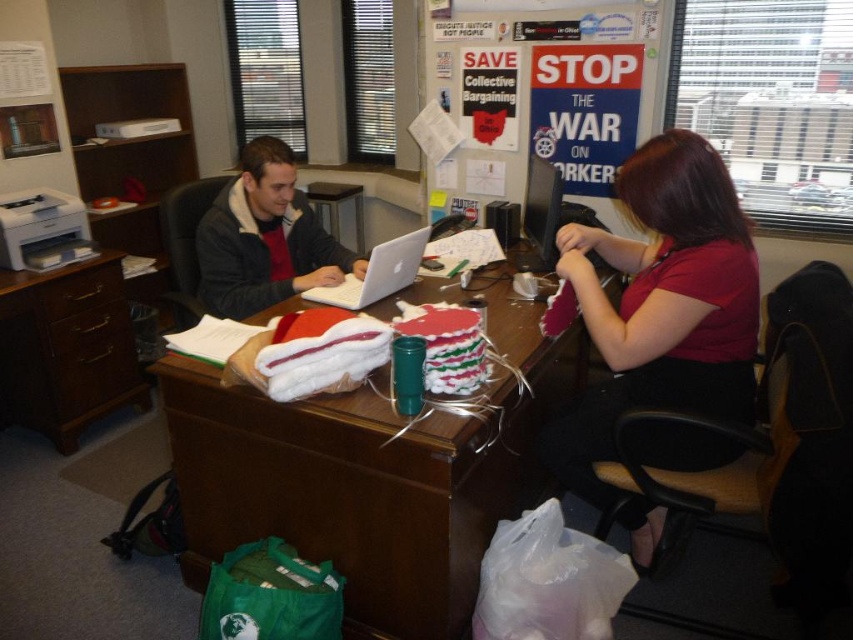
You are organizing the desk and need to move the silver metallic laptop at center closer to the edge. Which direction should you move it to get it away from the dark gray jacket at center?

You should move the silver metallic laptop at center to the right to get it away from the dark gray jacket at center, since the dark gray jacket at center is currently to the left of the laptop.

You are an office worker who needs to place a 12 inch wide document on the desk. The dark gray jacket at center and silver metallic laptop at center are in the way. Can you fit the document between them?

The dark gray jacket at center might be wider than silver metallic laptop at center, so the space between them may not be sufficient to fit a 12 inch wide document.

You are a tailor who needs to adjust the size of the matte red shirt at center so it fits perfectly over the silver metallic laptop at center. Given their sizes, what adjustment would you recommend?

The matte red shirt at center is wider than the silver metallic laptop at center. To make the shirt fit over the laptop, you should reduce the shirt width to match the laptop size.